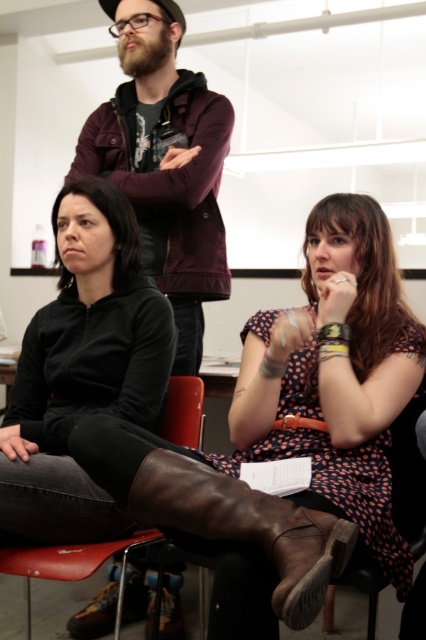
You are standing in the room and want to point to the location of the point marked at coordinates [164,163]. Based on the scene description, where exactly would this point be located?

The point marked at coordinates [164,163] is located on the maroon hoodie at upper center.

You are sitting on the brown leather chair at lower right and want to pass a note to the person wearing the maroon hoodie at upper center. Which direction should you pass it to reach them?

The maroon hoodie at upper center is on the left side of the brown leather chair at lower right, so you should pass the note to the left to reach them.

Based on the scene description, which object is taller between the maroon hoodie at upper center and the leather chair at lower center?

The maroon hoodie at upper center is taller than the leather chair at lower center according to the description.